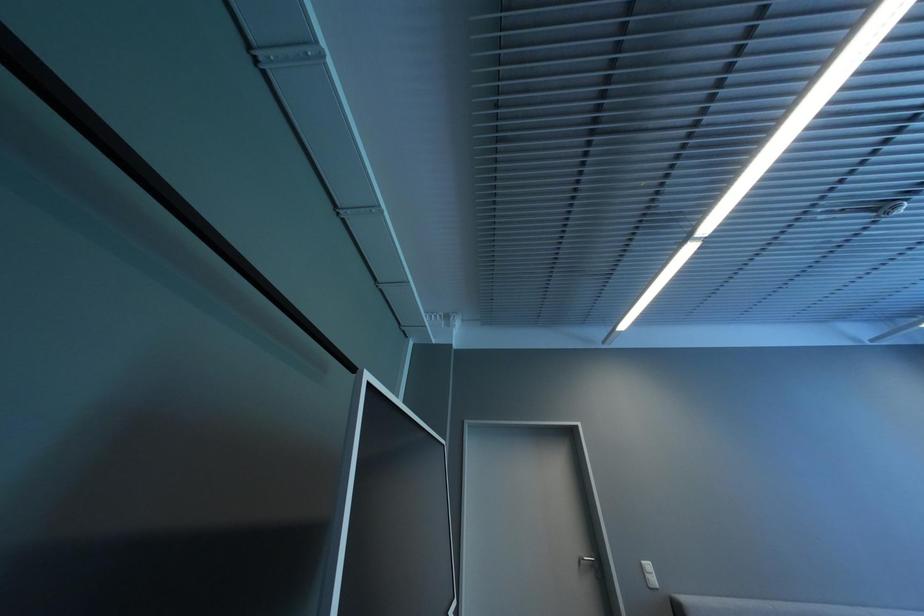
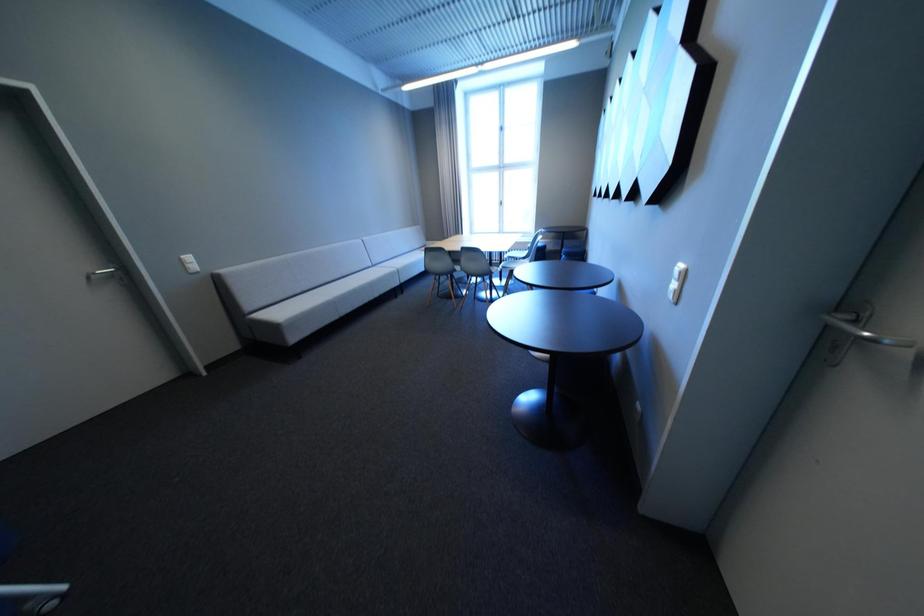
First-person continuous shooting, in which direction is the camera rotating?

The camera rotated toward right-down.